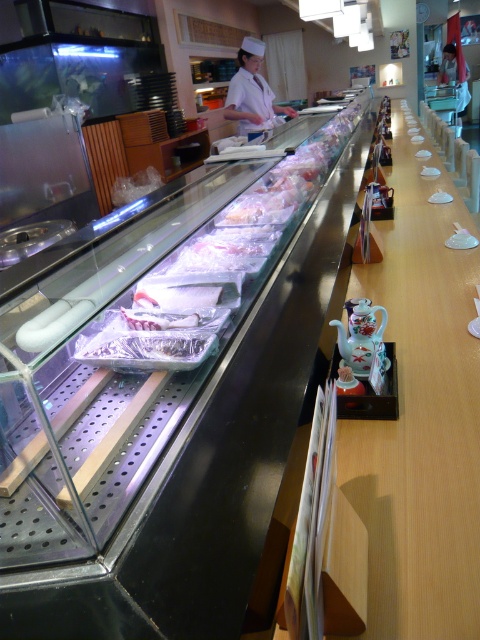
You are standing in the sushi restaurant and want to reach the point marked as point (251, 38). The restaurant has a strict rule that you must stay at least 6 feet away from the refrigerated display case on the left side. Can you safely reach the point without violating the rule?

The point (251, 38) is 14.16 feet from the viewer. Since the minimum required distance is 6 feet, you can safely reach the point without violating the rule as 14.16 feet is greater than 6 feet.

You are a customer at the sushi restaurant and want to place your teacup on the counter without it touching the white uniform at center. Given that the porcelain teapot at center is in the way, can you estimate if there is enough space between them to place your teacup?

The white uniform at center is wider than the porcelain teapot at center, so there is sufficient space between them to place your teacup without it touching either object.